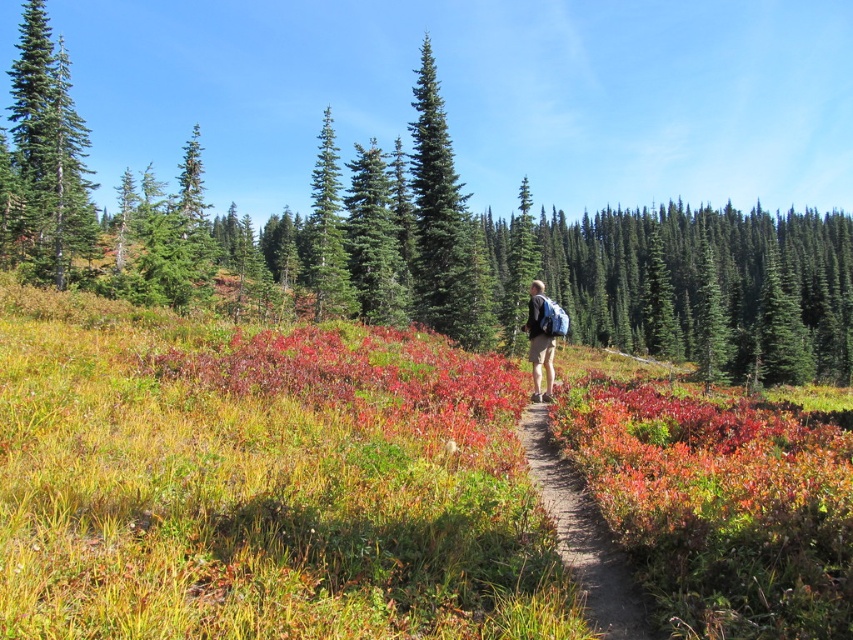
Question: Which point is closer to the camera?

Choices:
 (A) vibrant red leaves at center
 (B) green grassy at center
 (C) matte blue backpack at center
 (D) green matte evergreen tree at left

Answer: (B)

Question: Is vibrant red leaves at center further to camera compared to matte blue backpack at center?

Choices:
 (A) yes
 (B) no

Answer: (B)

Question: Which object is closer to the camera taking this photo?

Choices:
 (A) brown dirt path at center
 (B) green matte evergreen tree at left

Answer: (A)

Question: Where is green grassy at center located in relation to brown dirt path at center in the image?

Choices:
 (A) below
 (B) above

Answer: (B)

Question: Which point is closer to the camera taking this photo?

Choices:
 (A) (85, 145)
 (B) (654, 534)

Answer: (B)

Question: Does green textured pine tree at center appear on the left side of green matte evergreen tree at left?

Choices:
 (A) yes
 (B) no

Answer: (B)